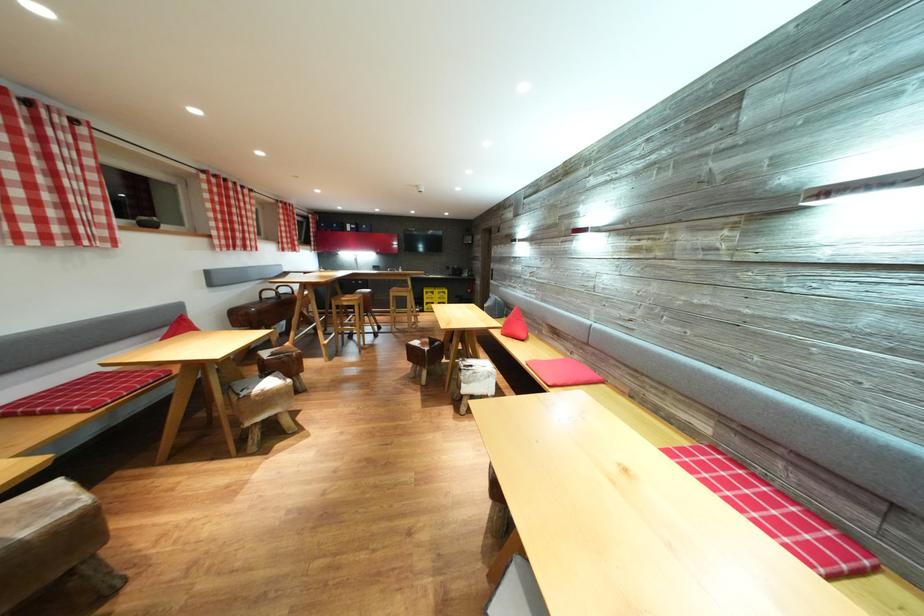
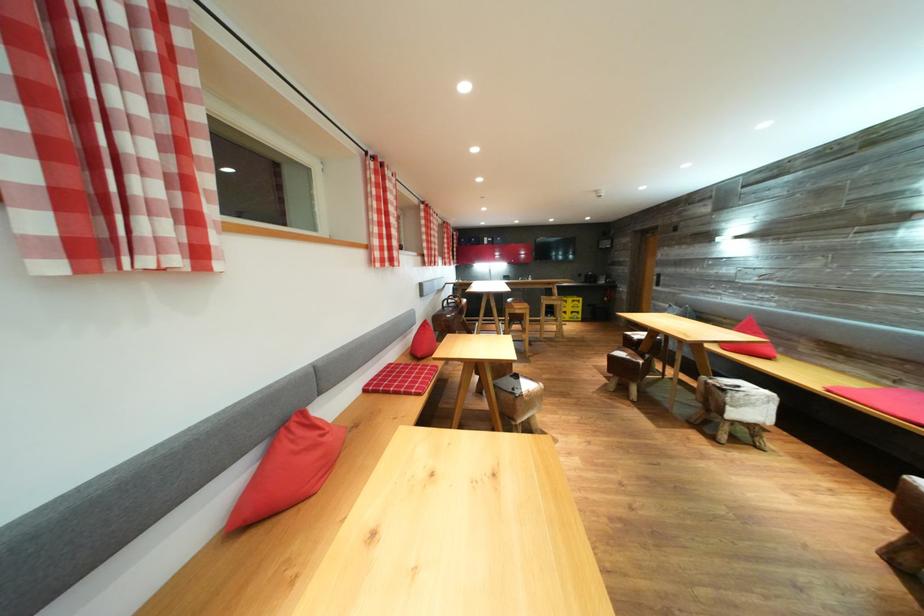
The point at (444, 297) is marked in the first image. Where is the corresponding point in the second image?

(577, 305)